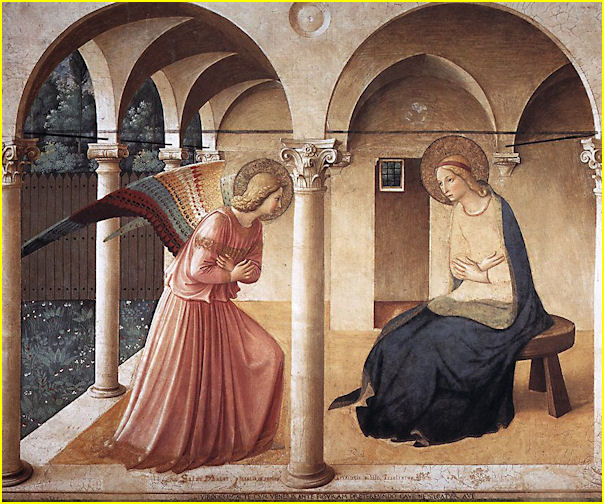
This screenshot has width=604, height=504. Identify the location of stool. (539, 345).